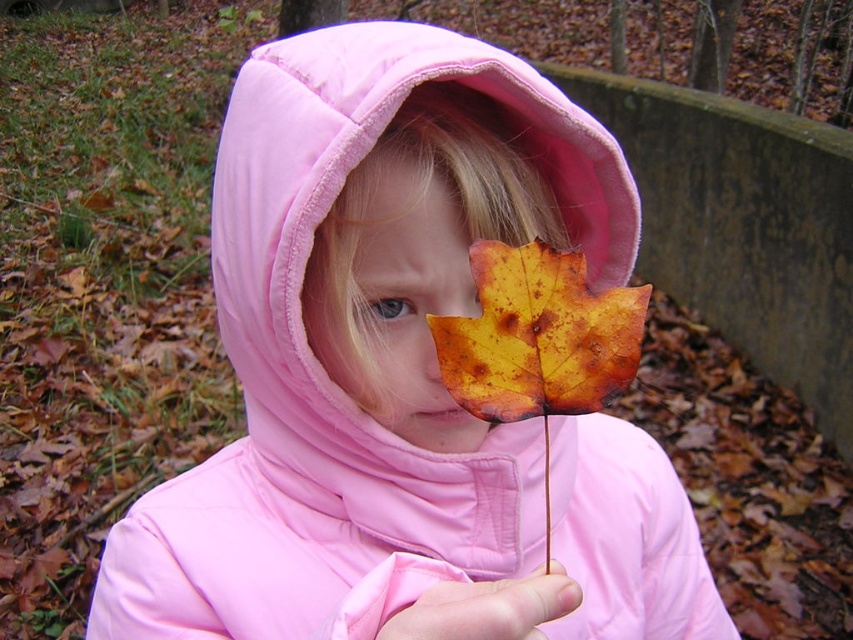
Question: Is matte pink jacket at center to the right of yellow matte leaf at center from the viewer's perspective?

Choices:
 (A) yes
 (B) no

Answer: (A)

Question: Which point is closer to the camera taking this photo?

Choices:
 (A) (347, 136)
 (B) (500, 384)
 (C) (590, 124)
 (D) (440, 282)

Answer: (B)

Question: Estimate the real-world distances between objects in this image. Which object is farther from the pink fleece hood at center?

Choices:
 (A) yellow matte leaf at center
 (B) pink smooth hand at center
 (C) yellow-brown textured leaf at center
 (D) matte pink jacket at center

Answer: (B)

Question: Among these points, which one is nearest to the camera?

Choices:
 (A) (537, 392)
 (B) (461, 624)
 (C) (438, 256)
 (D) (234, 531)

Answer: (B)

Question: Does matte pink jacket at center appear over pink smooth hand at center?

Choices:
 (A) yes
 (B) no

Answer: (B)

Question: Is pink fleece hood at center closer to the viewer compared to yellow matte leaf at center?

Choices:
 (A) yes
 (B) no

Answer: (A)